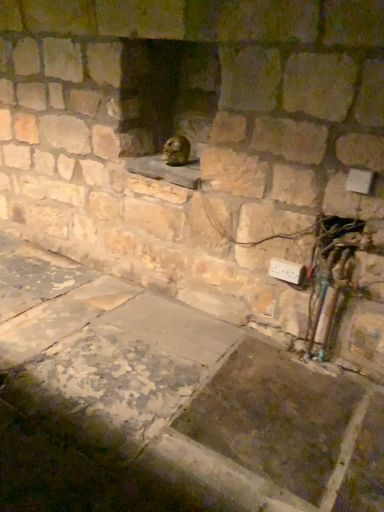
Question: From the image's perspective, is shiny brown rodent at center below white plastic electric outlet at lower right?

Choices:
 (A) no
 (B) yes

Answer: (A)

Question: From a real-world perspective, is shiny brown rodent at center over white plastic electric outlet at lower right?

Choices:
 (A) no
 (B) yes

Answer: (B)

Question: Is shiny brown rodent at center smaller than white plastic electric outlet at lower right?

Choices:
 (A) no
 (B) yes

Answer: (A)

Question: Is shiny brown rodent at center aimed at white plastic electric outlet at lower right?

Choices:
 (A) no
 (B) yes

Answer: (A)

Question: Considering the relative positions of shiny brown rodent at center and white plastic electric outlet at lower right in the image provided, is shiny brown rodent at center behind white plastic electric outlet at lower right?

Choices:
 (A) no
 (B) yes

Answer: (B)

Question: Can white plastic electric outlet at lower right be found inside shiny brown rodent at center?

Choices:
 (A) yes
 (B) no

Answer: (B)

Question: From the image's perspective, would you say white plastic electric outlet at lower right is positioned over shiny brown rodent at center?

Choices:
 (A) yes
 (B) no

Answer: (B)

Question: Is white plastic electric outlet at lower right not close to shiny brown rodent at center?

Choices:
 (A) yes
 (B) no

Answer: (B)

Question: Is white plastic electric outlet at lower right positioned before shiny brown rodent at center?

Choices:
 (A) no
 (B) yes

Answer: (B)

Question: Can you confirm if white plastic electric outlet at lower right is bigger than shiny brown rodent at center?

Choices:
 (A) no
 (B) yes

Answer: (A)

Question: Does white plastic electric outlet at lower right touch shiny brown rodent at center?

Choices:
 (A) no
 (B) yes

Answer: (A)

Question: Can you confirm if white plastic electric outlet at lower right is positioned to the right of shiny brown rodent at center?

Choices:
 (A) yes
 (B) no

Answer: (A)

Question: Does point (170, 148) appear closer or farther from the camera than point (294, 274)?

Choices:
 (A) farther
 (B) closer

Answer: (A)